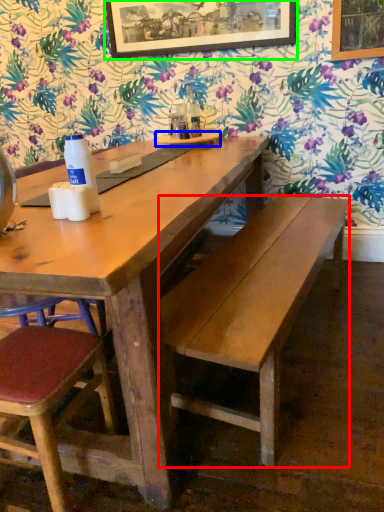
Question: Considering the real-world distances, which object is closest to bench (highlighted by a red box)? plate (highlighted by a blue box) or picture frame (highlighted by a green box).

Choices:
 (A) plate
 (B) picture frame

Answer: (A)